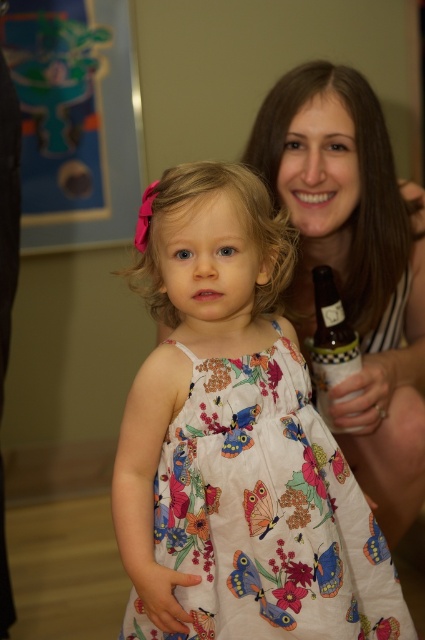
Question: Does matte white dress at center appear on the right side of translucent glass bottle at right?

Choices:
 (A) no
 (B) yes

Answer: (B)

Question: Which object is the closest to the floral cotton dress at center?

Choices:
 (A) matte white dress at center
 (B) translucent glass bottle at right

Answer: (B)

Question: Is floral cotton dress at center closer to the viewer compared to matte white dress at center?

Choices:
 (A) yes
 (B) no

Answer: (A)

Question: Considering the real-world distances, which object is closest to the translucent glass bottle at right?

Choices:
 (A) floral cotton dress at center
 (B) matte white dress at center

Answer: (B)

Question: Does matte white dress at center appear on the right side of translucent glass bottle at right?

Choices:
 (A) no
 (B) yes

Answer: (B)

Question: Estimate the real-world distances between objects in this image. Which object is farther from the matte white dress at center?

Choices:
 (A) floral cotton dress at center
 (B) translucent glass bottle at right

Answer: (A)